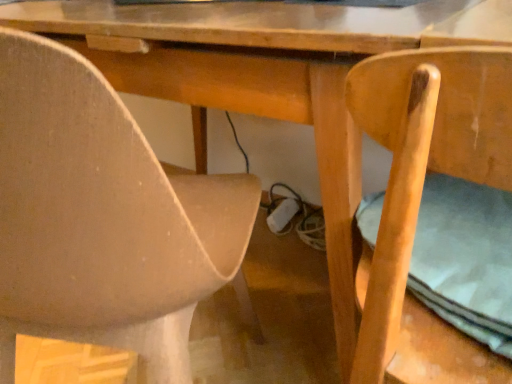
Question: Is matte beige chair at lower left, which is the 2th chair from right to left, taller or shorter than light brown wood chair at right, which is the 1th chair in right-to-left order?

Choices:
 (A) tall
 (B) short

Answer: (A)

Question: Which is correct: matte beige chair at lower left, acting as the first chair starting from the left, is inside light brown wood chair at right, which is the 1th chair in right-to-left order, or outside of it?

Choices:
 (A) outside
 (B) inside

Answer: (A)

Question: In the image, is matte beige chair at lower left, which is the 2th chair from right to left, on the left side or the right side of light brown wood chair at right, the second chair in the left-to-right sequence?

Choices:
 (A) right
 (B) left

Answer: (B)

Question: Is light brown wood chair at right, which is the 1th chair in right-to-left order, taller or shorter than matte beige chair at lower left, which is the 2th chair from right to left?

Choices:
 (A) tall
 (B) short

Answer: (B)

Question: In terms of width, does light brown wood chair at right, which is the 1th chair in right-to-left order, look wider or thinner when compared to matte beige chair at lower left, acting as the first chair starting from the left?

Choices:
 (A) thin
 (B) wide

Answer: (A)

Question: In the image, is light brown wood chair at right, the second chair in the left-to-right sequence, positioned in front of or behind matte beige chair at lower left, which is the 2th chair from right to left?

Choices:
 (A) behind
 (B) front

Answer: (B)

Question: From a real-world perspective, is light brown wood chair at right, the second chair in the left-to-right sequence, positioned above or below matte beige chair at lower left, acting as the first chair starting from the left?

Choices:
 (A) below
 (B) above

Answer: (A)